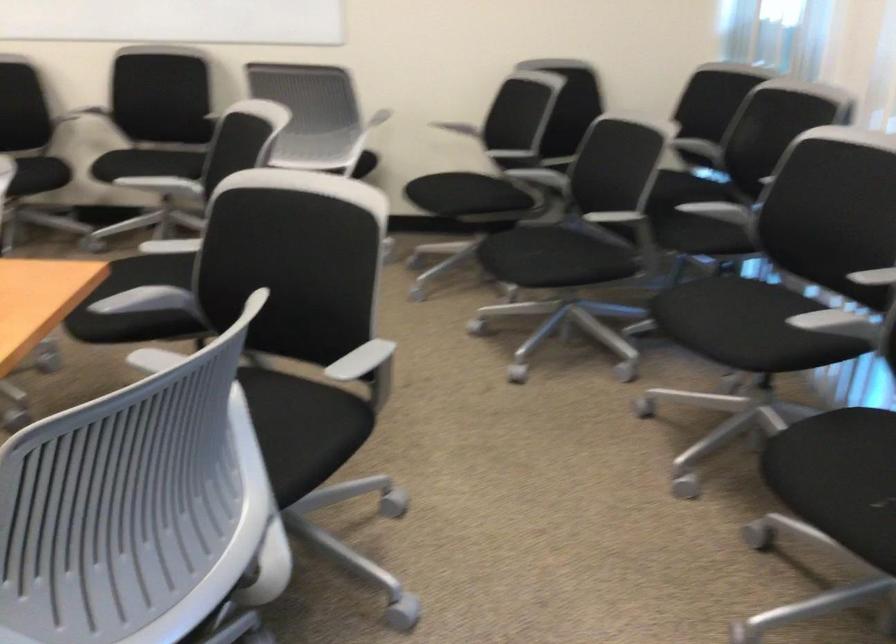
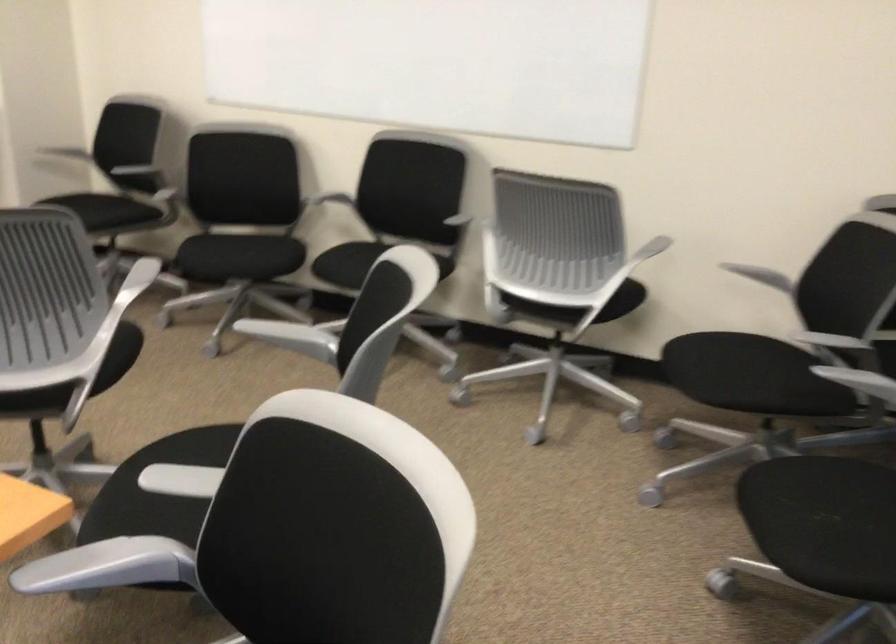
Question: The images are taken continuously from a first-person perspective. In which direction is your viewpoint rotating?

Choices:
 (A) Left
 (B) Right
 (C) Up
 (D) Down

Answer: (A)